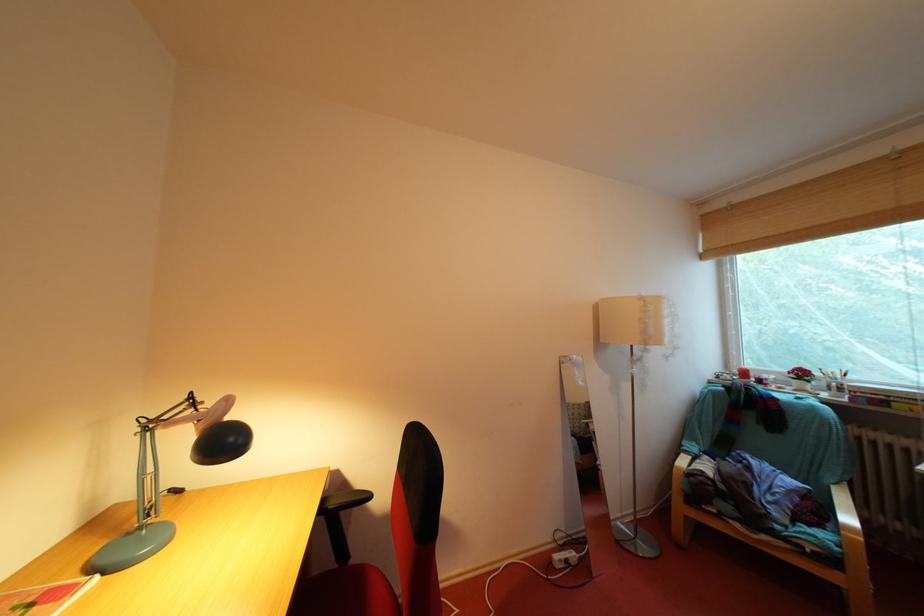
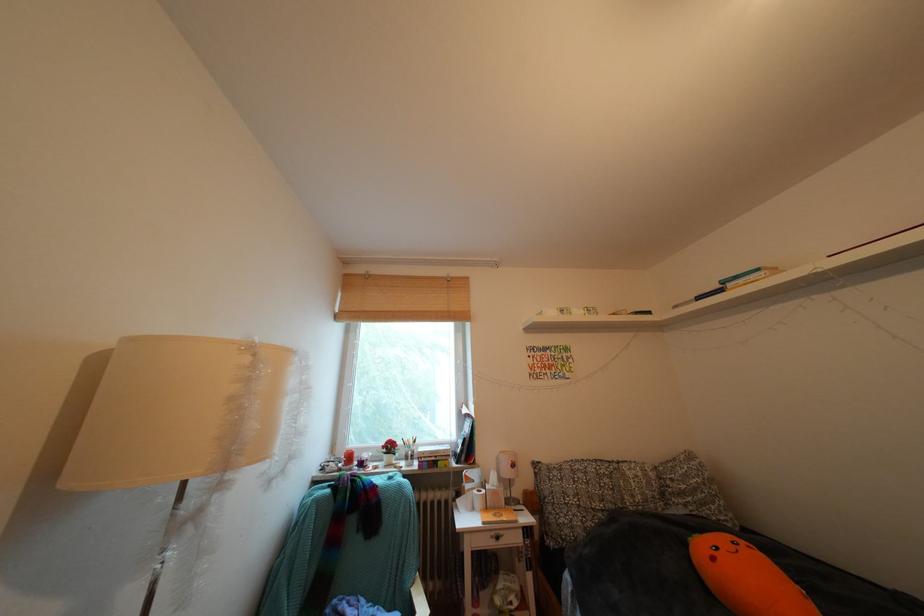
Where in the second image is the point corresponding to point (651, 304) from the first image?

(259, 353)